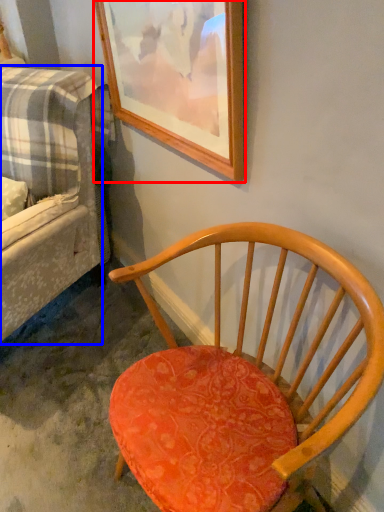
Question: Among these objects, which one is nearest to the camera, picture frame (highlighted by a red box) or studio couch (highlighted by a blue box)?

Choices:
 (A) picture frame
 (B) studio couch

Answer: (A)